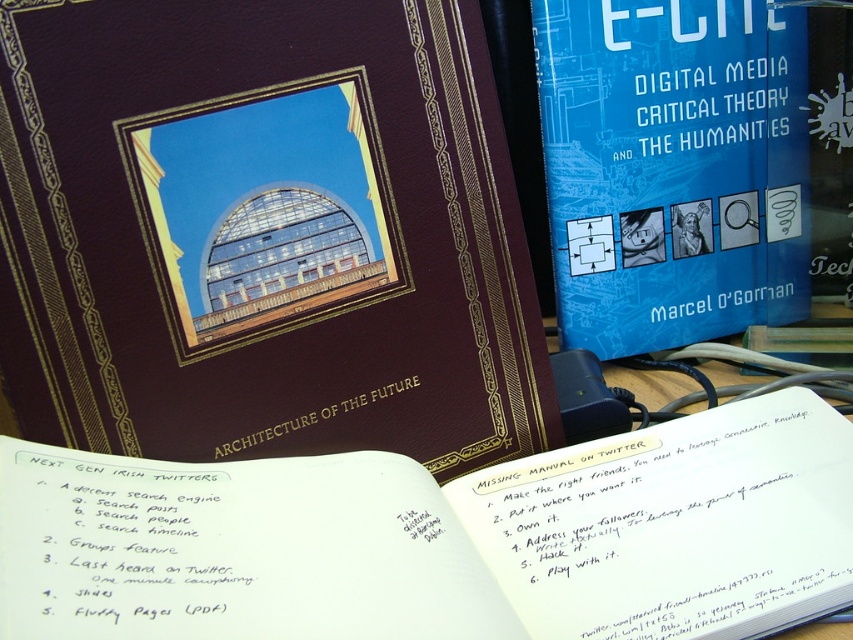
In the scene shown: You are organizing a desk and need to place both the white paper at center and the blue paper at upper right into a folder. Which paper should you place first to ensure both fit without overlapping?

You should place the white paper at center first since it is bigger than the blue paper at upper right, allowing enough space for the smaller one afterward.

You are organizing a shelf and need to place the matte brown book at center and the blue paper at upper right. Which item should you place first to ensure proper stacking?

You should place the matte brown book at center first because it is shorter than the blue paper at upper right, allowing the taller blue paper to be stacked on top without overhanging.